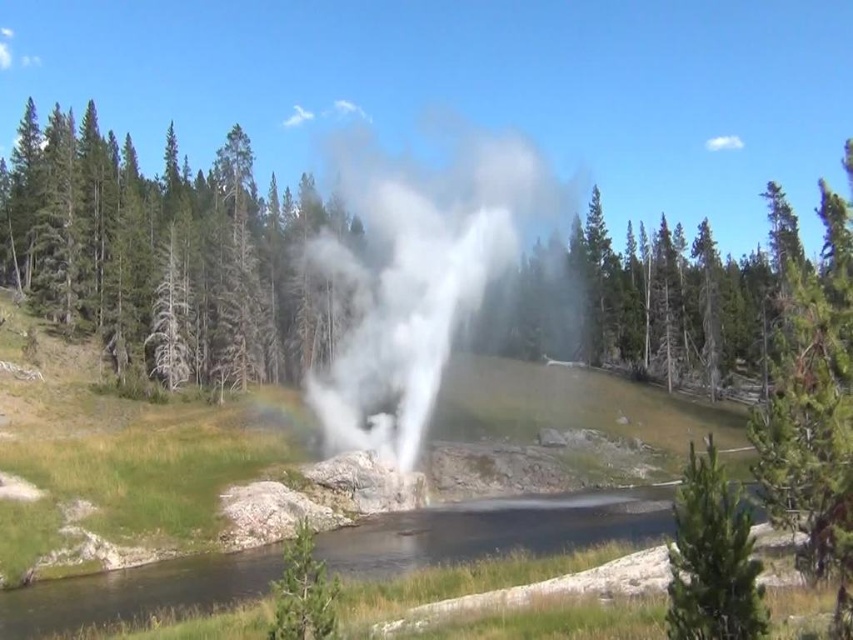
Question: Can you confirm if white vapor at center is positioned above green textured pine at lower right?

Choices:
 (A) yes
 (B) no

Answer: (A)

Question: Which point is closer to the camera taking this photo?

Choices:
 (A) (689, 605)
 (B) (358, 445)

Answer: (A)

Question: Can you confirm if white vapor at center is positioned above green textured pine at lower right?

Choices:
 (A) yes
 (B) no

Answer: (A)

Question: Is white vapor at center to the left of green textured pine at lower right from the viewer's perspective?

Choices:
 (A) no
 (B) yes

Answer: (B)